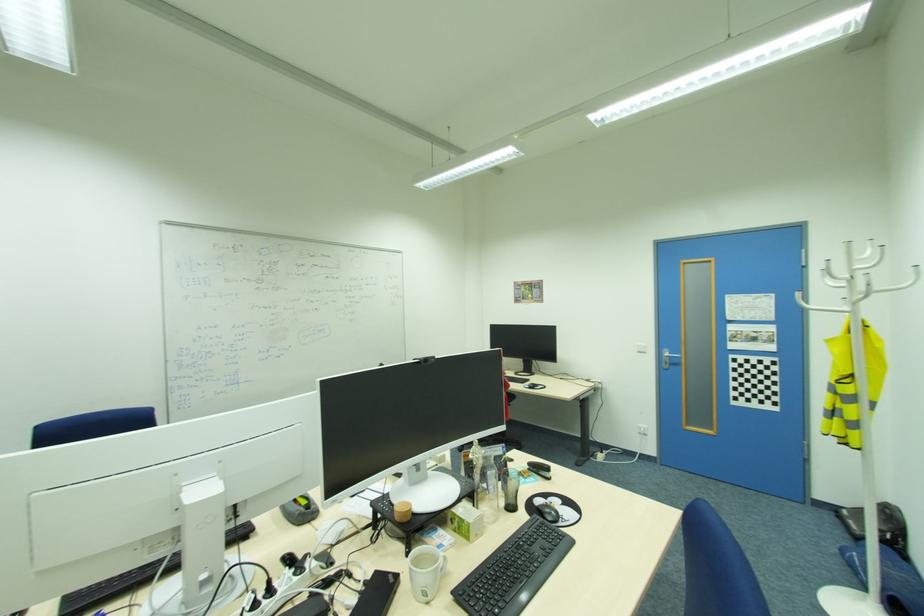
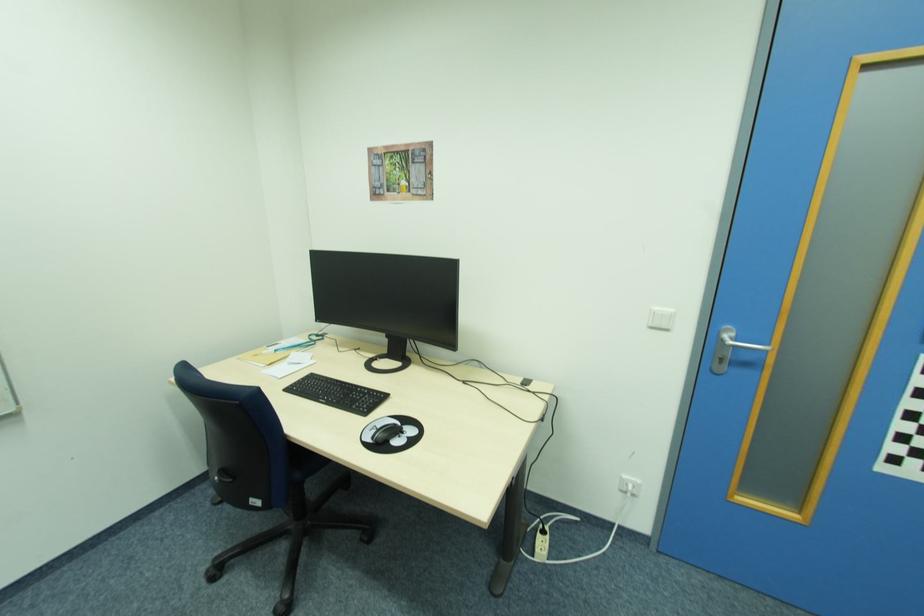
In the second image, find the point that corresponds to point (648, 353) in the first image.

(670, 329)